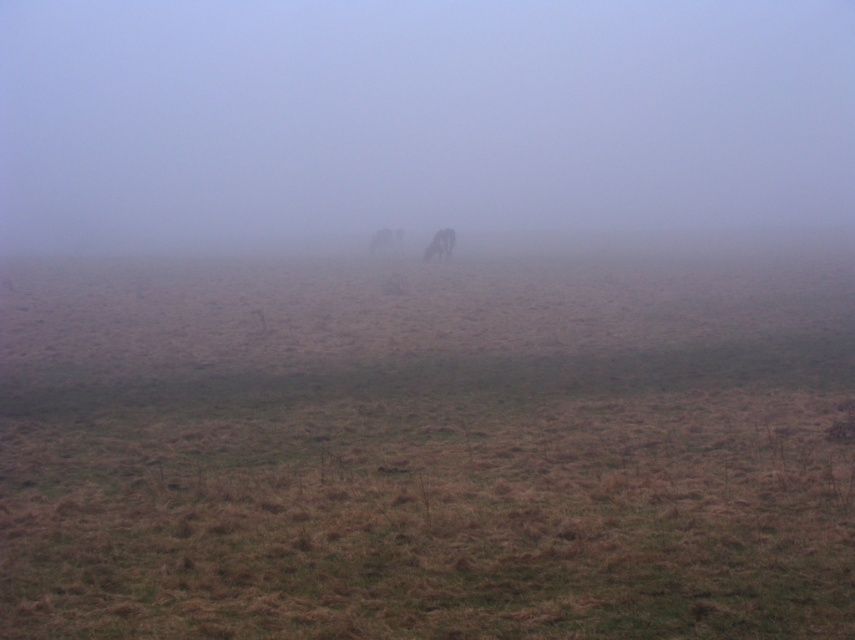
Question: Among these objects, which one is nearest to the camera?

Choices:
 (A) brown fur horse at center
 (B) foggy atmosphere at center

Answer: (A)

Question: In this image, where is foggy atmosphere at center located relative to brown furry dog at center?

Choices:
 (A) left
 (B) right

Answer: (A)

Question: Which point is closer to the camera?

Choices:
 (A) brown fur horse at center
 (B) foggy atmosphere at center

Answer: (A)

Question: Which point is closer to the camera?

Choices:
 (A) brown fur horse at center
 (B) foggy atmosphere at center
 (C) brown furry dog at center

Answer: (A)

Question: Where is foggy atmosphere at center located in relation to brown furry dog at center in the image?

Choices:
 (A) above
 (B) below

Answer: (A)

Question: Can you confirm if foggy atmosphere at center is thinner than brown furry dog at center?

Choices:
 (A) no
 (B) yes

Answer: (A)